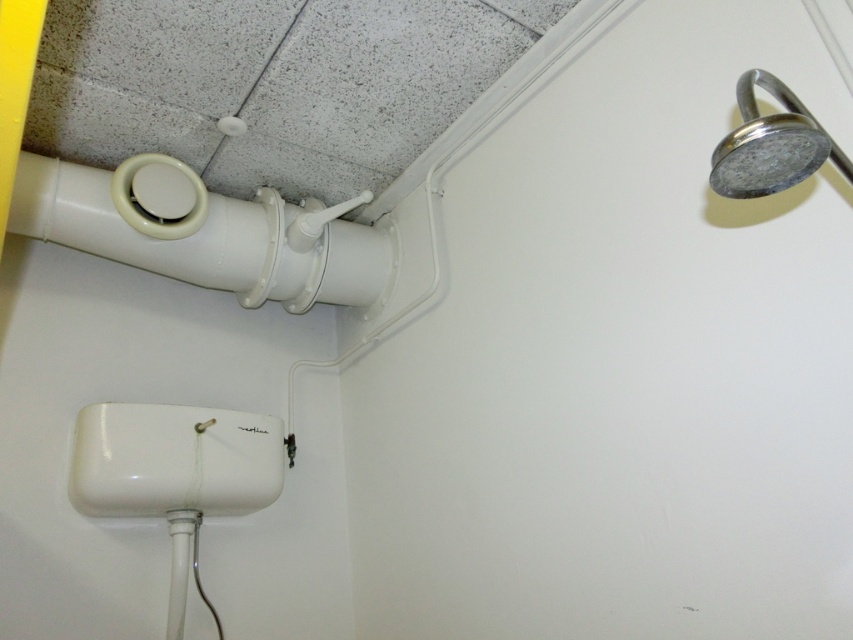
From the picture: What are the coordinates of the white plastic pipe at upper left in the image?

The white plastic pipe at upper left is located at coordinates (202,230).

You are a plumber inspecting the bathroom plumbing. You need to determine which of the two fixtures, the white plastic pipe at upper left or the chrome metallic shower head at upper right, requires more space for maintenance. Based on their sizes, which one would you prioritize?

The white plastic pipe at upper left is larger in size than the chrome metallic shower head at upper right, so it would require more space for maintenance and should be prioritized.